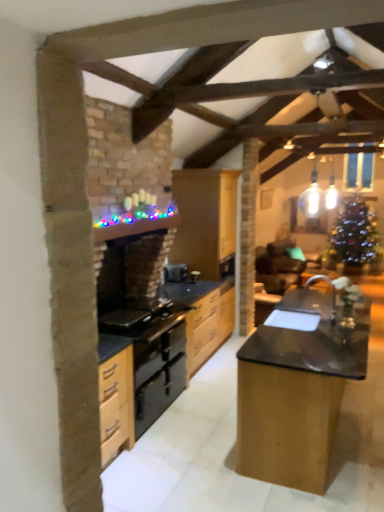
At what (x,y) coordinates should I click in order to perform the action: click on black polished wood table at center. Please return your answer as a coordinate pair (x, y). Looking at the image, I should click on (297, 392).

Measure the distance between point (326, 278) and camera.

The depth of point (326, 278) is 4.36 meters.

In order to face wooden cabinets at center, should I rotate leftwards or rightwards?

Rotate right and turn 1.596 degrees.

In order to face black matte oven at center, should I rotate leftwards or rightwards?

Rotate left and turn 2.248 degrees.

What is the approximate height of teal fabric armchair at center?

36.74 inches.

I want to click on black polished wood table at center, so click(297, 392).

Considering the sizes of objects wooden cabinets at center and black granite sink at center in the image provided, who is wider, wooden cabinets at center or black granite sink at center?

With larger width is wooden cabinets at center.

Visually, is wooden cabinets at center positioned to the left or to the right of black granite sink at center?

Clearly, wooden cabinets at center is on the left of black granite sink at center in the image.

From the image's perspective, is wooden cabinets at center located above black granite sink at center?

Indeed, from the image's perspective, wooden cabinets at center is shown above black granite sink at center.

Between teal fabric armchair at center and black granite sink at center, which one has smaller width?

Thinner between the two is black granite sink at center.

In the scene shown: Which is farther, (x=273, y=290) or (x=293, y=324)?

The point (x=273, y=290) is farther.

Could you tell me if teal fabric armchair at center is turned towards black granite sink at center?

No, teal fabric armchair at center does not turn towards black granite sink at center.

Which is more to the left, teal fabric armchair at center or black granite sink at center?

black granite sink at center is more to the left.

From their relative heights in the image, would you say black polished wood table at center is taller or shorter than black granite sink at center?

Considering their sizes, black polished wood table at center has more height than black granite sink at center.

Between black polished wood table at center and black granite sink at center, which one has larger width?

Wider between the two is black polished wood table at center.

From the image's perspective, which one is positioned lower, black polished wood table at center or black granite sink at center?

From the image's view, black polished wood table at center is below.

From a real-world perspective, is black polished wood table at center located higher than black granite sink at center?

No, from a real-world perspective, black polished wood table at center is not over black granite sink at center

Considering the sizes of wooden cabinets at center and black matte oven at center in the image, is wooden cabinets at center wider or thinner than black matte oven at center?

In the image, wooden cabinets at center appears to be wider than black matte oven at center.

How much distance is there between wooden cabinets at center and black matte oven at center?

wooden cabinets at center is 56.60 centimeters from black matte oven at center.

Is wooden cabinets at center oriented towards black matte oven at center?

No, wooden cabinets at center is not oriented towards black matte oven at center.

Image resolution: width=384 pixels, height=512 pixels. In order to click on cabinetry positioned vertically above the black matte oven at center (from a real-world perspective) in this screenshot , I will do `click(206, 221)`.

From the picture: Is black granite sink at center wider than wooden cabinets at center?

No.

Can you confirm if black granite sink at center is taller than wooden cabinets at center?

No, black granite sink at center is not taller than wooden cabinets at center.

From the image's perspective, is black granite sink at center located above or below wooden cabinets at center?

From the image's perspective, black granite sink at center appears below wooden cabinets at center.

Can you see wooden cabinets at center touching black polished wood table at center?

No, wooden cabinets at center is not with black polished wood table at center.

Is wooden cabinets at center looking in the opposite direction of black polished wood table at center?

No, black polished wood table at center is not at the back of wooden cabinets at center.

Who is more distant, wooden cabinets at center or black polished wood table at center?

wooden cabinets at center is further from the camera.

Identify the location of cabinetry on the left side of black polished wood table at center. The height and width of the screenshot is (512, 384). (206, 221).

From the image's perspective, is black granite countertop at center on black granite sink at center?

Incorrect, from the image's perspective, black granite countertop at center is lower than black granite sink at center.

Based on the photo, considering the sizes of black granite countertop at center and black granite sink at center in the image, is black granite countertop at center bigger or smaller than black granite sink at center?

Considering their sizes, black granite countertop at center takes up more space than black granite sink at center.

Between black granite countertop at center and black granite sink at center, which one has smaller width?

Thinner between the two is black granite sink at center.

From a real-world perspective, which object stands above the other?

black granite sink at center, from a real-world perspective.

Where is `sink below the wooden cabinets at center (from a real-world perspective)`? sink below the wooden cabinets at center (from a real-world perspective) is located at coordinates (302, 308).

This screenshot has height=512, width=384. Find the location of `armchair that appears on the right of black granite sink at center`. armchair that appears on the right of black granite sink at center is located at coordinates (278, 267).

Which object lies further to the anchor point black granite countertop at center, black granite sink at center or wooden cabinets at center?

Among the two, black granite sink at center is located further to black granite countertop at center.

Looking at the image, which one is located further to black granite sink at center, black granite countertop at center or black polished wood table at center?

black granite countertop at center is positioned further to the anchor black granite sink at center.

Based on their spatial positions, is black polished wood table at center or black granite sink at center closer to wooden cabinets at center?

black granite sink at center is closer to wooden cabinets at center.

When comparing their distances from black polished wood table at center, does wooden cabinets at center or teal fabric armchair at center seem further?

wooden cabinets at center is further to black polished wood table at center.

Based on their spatial positions, is wooden cabinets at center or black granite sink at center closer to teal fabric armchair at center?

black granite sink at center is closer to teal fabric armchair at center.

Looking at this image, which object lies further to the anchor point black polished wood table at center, black matte oven at center or teal fabric armchair at center?

Among the two, black matte oven at center is located further to black polished wood table at center.

Based on their spatial positions, is teal fabric armchair at center or black matte oven at center closer to black polished wood table at center?

teal fabric armchair at center is closer to black polished wood table at center.

Which object lies nearer to the anchor point teal fabric armchair at center, black granite countertop at center or black matte oven at center?

The object closer to teal fabric armchair at center is black granite countertop at center.

Find the location of a particular element. sink between black polished wood table at center and wooden cabinets at center from front to back is located at coordinates (302, 308).

Locate an element on the screen. The image size is (384, 512). countertop positioned between black polished wood table at center and teal fabric armchair at center from near to far is located at coordinates (204, 316).

Locate an element on the screen. The width and height of the screenshot is (384, 512). appliance between black granite sink at center and teal fabric armchair at center along the z-axis is located at coordinates (175, 272).

Locate an element on the screen. The image size is (384, 512). cabinetry between black polished wood table at center and black matte oven at center from front to back is located at coordinates (206, 221).